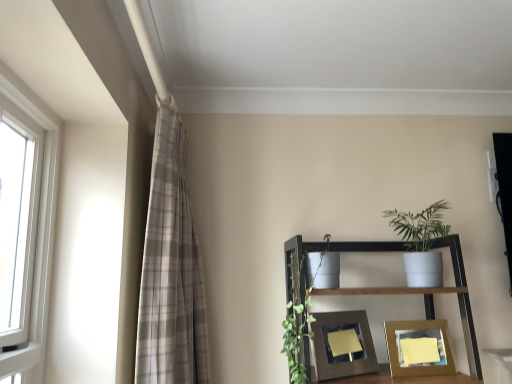
Question: Is the position of matte brown picture frame at center, which appears as the second picture frame when viewed from the right, less distant than that of wooden picture frame at lower center, the 1th picture frame from the right?

Choices:
 (A) yes
 (B) no

Answer: (A)

Question: From the image's perspective, does matte brown picture frame at center, which appears as the second picture frame when viewed from the right, appear higher than wooden picture frame at lower center, which is the 2th picture frame from left to right?

Choices:
 (A) no
 (B) yes

Answer: (B)

Question: Is matte brown picture frame at center, the 1th picture frame from the left, further to the viewer compared to wooden picture frame at lower center, the 1th picture frame from the right?

Choices:
 (A) yes
 (B) no

Answer: (B)

Question: From the image's perspective, would you say matte brown picture frame at center, which appears as the second picture frame when viewed from the right, is shown under wooden picture frame at lower center, which is the 2th picture frame from left to right?

Choices:
 (A) no
 (B) yes

Answer: (A)

Question: Would you say matte brown picture frame at center, the 1th picture frame from the left, contains wooden picture frame at lower center, the 1th picture frame from the right?

Choices:
 (A) yes
 (B) no

Answer: (B)

Question: Does point (450, 367) appear closer or farther from the camera than point (36, 119)?

Choices:
 (A) farther
 (B) closer

Answer: (A)

Question: Considering the positions of wooden picture frame at lower center, the 1th picture frame from the right, and white plastic window at left in the image, is wooden picture frame at lower center, the 1th picture frame from the right, wider or thinner than white plastic window at left?

Choices:
 (A) wide
 (B) thin

Answer: (A)

Question: From their relative heights in the image, would you say wooden picture frame at lower center, the 1th picture frame from the right, is taller or shorter than white plastic window at left?

Choices:
 (A) tall
 (B) short

Answer: (B)

Question: From a real-world perspective, is wooden picture frame at lower center, the 1th picture frame from the right, positioned above or below white plastic window at left?

Choices:
 (A) above
 (B) below

Answer: (B)

Question: Visually, is matte brown picture frame at center, the 1th picture frame from the left, positioned to the left or to the right of wooden picture frame at lower center, the 1th picture frame from the right?

Choices:
 (A) right
 (B) left

Answer: (B)

Question: Is matte brown picture frame at center, which appears as the second picture frame when viewed from the right, in front of or behind wooden picture frame at lower center, which is the 2th picture frame from left to right, in the image?

Choices:
 (A) behind
 (B) front

Answer: (B)

Question: Looking at their shapes, would you say matte brown picture frame at center, the 1th picture frame from the left, is wider or thinner than wooden picture frame at lower center, which is the 2th picture frame from left to right?

Choices:
 (A) wide
 (B) thin

Answer: (B)

Question: Is point (316, 374) positioned closer to the camera than point (421, 340)?

Choices:
 (A) closer
 (B) farther

Answer: (A)

Question: In terms of height, does plaid fabric curtain at left look taller or shorter compared to white plastic window at left?

Choices:
 (A) tall
 (B) short

Answer: (A)

Question: Considering the positions of point (185, 246) and point (42, 334), is point (185, 246) closer or farther from the camera than point (42, 334)?

Choices:
 (A) farther
 (B) closer

Answer: (A)